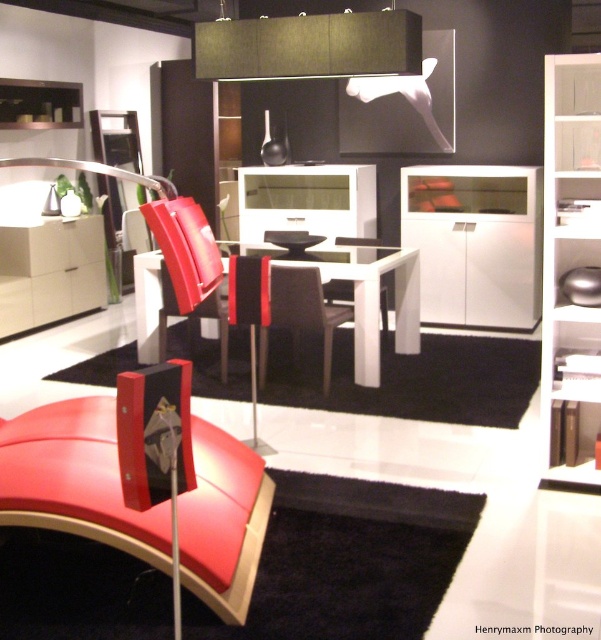
You are a customer in a furniture store and want to sit at the white glossy table at center. There is a black leather armchair at center in the way. Can you walk around it to reach the table?

The black leather armchair at center is behind the white glossy table at center, so you can walk around the armchair to reach the table.